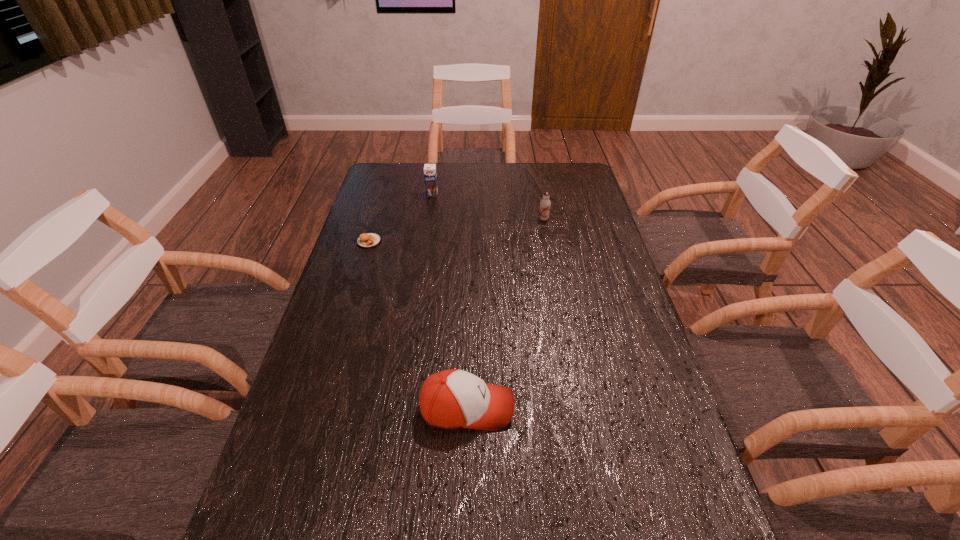
Find the location of `the farthest object`. the farthest object is located at coordinates (430, 176).

This screenshot has height=540, width=960. Identify the location of the taller chocolate milk. (430, 176).

The width and height of the screenshot is (960, 540). Find the location of `baseball cap`. baseball cap is located at coordinates (450, 399).

I want to click on the second object from right to left, so click(x=450, y=399).

You are a GUI agent. You are given a task and a screenshot of the screen. Output one action in this format:
    pyautogui.click(x=<x>, y=<y>)
    Task: Click on the rightmost object
    The height and width of the screenshot is (540, 960).
    Given the screenshot: What is the action you would take?
    pyautogui.click(x=544, y=210)

This screenshot has width=960, height=540. In order to click on the right chocolate milk in this screenshot , I will do `click(544, 210)`.

The image size is (960, 540). I want to click on the shortest object, so click(369, 240).

In order to click on patty in this screenshot , I will do `click(369, 240)`.

Locate an element on the screen. The width and height of the screenshot is (960, 540). blank space located 0.210m on the front label of the left chocolate milk is located at coordinates (426, 230).

Find the location of a particular element. free location located on the front-facing side of the nearest object is located at coordinates (613, 408).